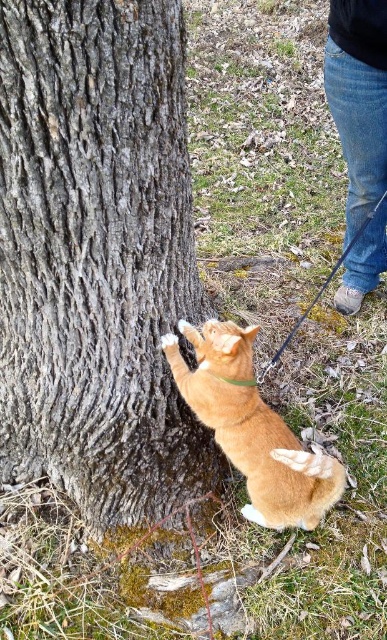
You are a small animal trying to cross the gap between the gray rough bark tree trunk at center and the orange fur cat at center. The animal can jump up to 12 inches. Do you think it can make the jump?

The distance between the gray rough bark tree trunk at center and the orange fur cat at center is 12.03 inches. Since the animal can jump up to 12 inches, it is just slightly too far, so the animal cannot make the jump.

From the picture: You are trying to decide whether to place a small potted plant between the orange fur cat at center and the jeans at lower right. Based on their widths, which object should the plant be closer to?

The orange fur cat at center is wider than the jeans at lower right, so the plant should be placed closer to the jeans at lower right to maintain balance.

You are standing at the origin point of the coordinate system in this scene. The gray rough bark tree trunk at center is located at a specific coordinate. Can you determine its exact position?

The gray rough bark tree trunk at center is located at point (97, 257).